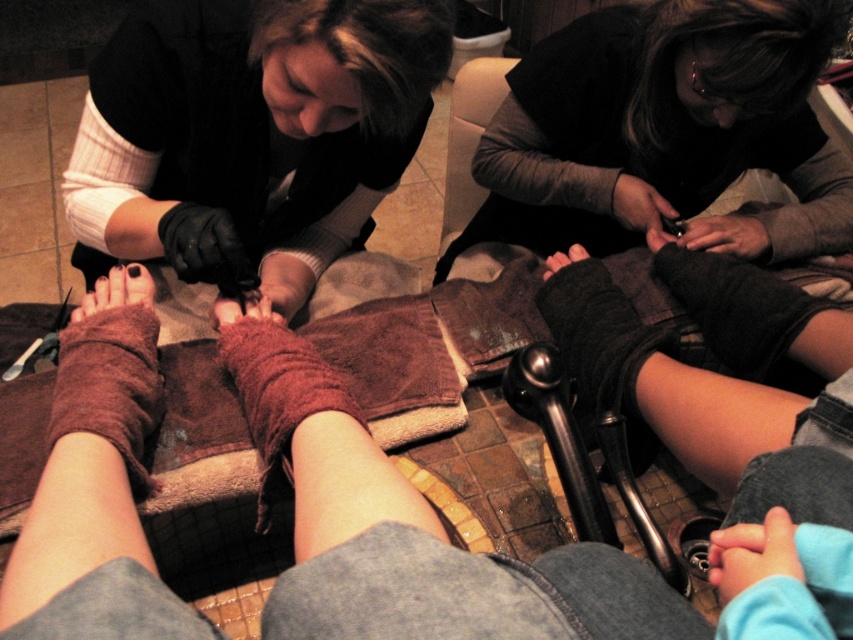
Question: Which object is the closest to the black matte gloves at upper left?

Choices:
 (A) brown fuzzy socks at lower left
 (B) blue fabric hand at lower right

Answer: (A)

Question: Does smooth skin hand at lower center appear under matte black nail clipper at lower center?

Choices:
 (A) no
 (B) yes

Answer: (B)

Question: Which object appears closest to the camera in this image?

Choices:
 (A) black wool sock at lower center
 (B) blue fabric hand at lower right

Answer: (B)

Question: Is smooth skin hand at lower center in front of matte black nail clipper at lower center?

Choices:
 (A) yes
 (B) no

Answer: (A)

Question: Does brown suede foot at center have a lesser width compared to brown fuzzy sock at lower left?

Choices:
 (A) yes
 (B) no

Answer: (B)

Question: Which is nearer to the matte black nail clipper at lower center?

Choices:
 (A) blue fabric hand at lower right
 (B) black matte gloves at upper left
 (C) dark gray wool sock at lower right

Answer: (C)